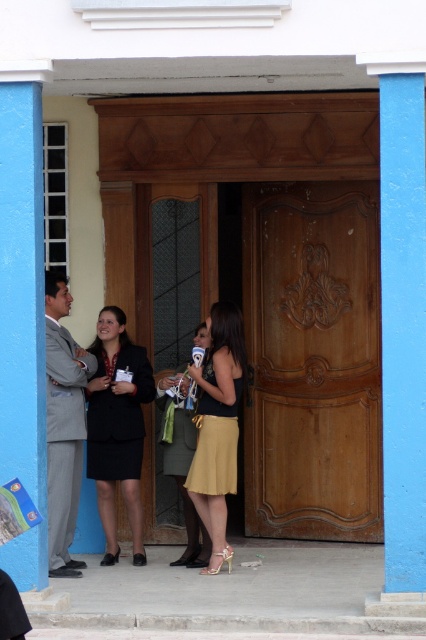
You are a photographer positioned in front of the large wooden door. You need to capture a photo where both the gray suit at left and the matte yellow skirt at center are clearly visible. Which person should you focus on first to ensure depth of field captures both subjects effectively?

The gray suit at left is closer to the viewer than the matte yellow skirt at center. To ensure both are in focus, you should focus on the gray suit at left, as it is the closer subject, and the depth of field will extend backward to include the matte yellow skirt at center.

You are a photographer trying to capture a group photo of the gold satin dress at center and the matte yellow skirt at center. The camera you are using has a minimum focus distance of 16 inches. Can you focus on both subjects simultaneously without moving the camera?

The gold satin dress at center and the matte yellow skirt at center are 16.42 inches apart from each other. Since the camera has a minimum focus distance of 16 inches, the distance between them is slightly more than the minimum requirement. Therefore, you can focus on both subjects simultaneously without moving the camera.